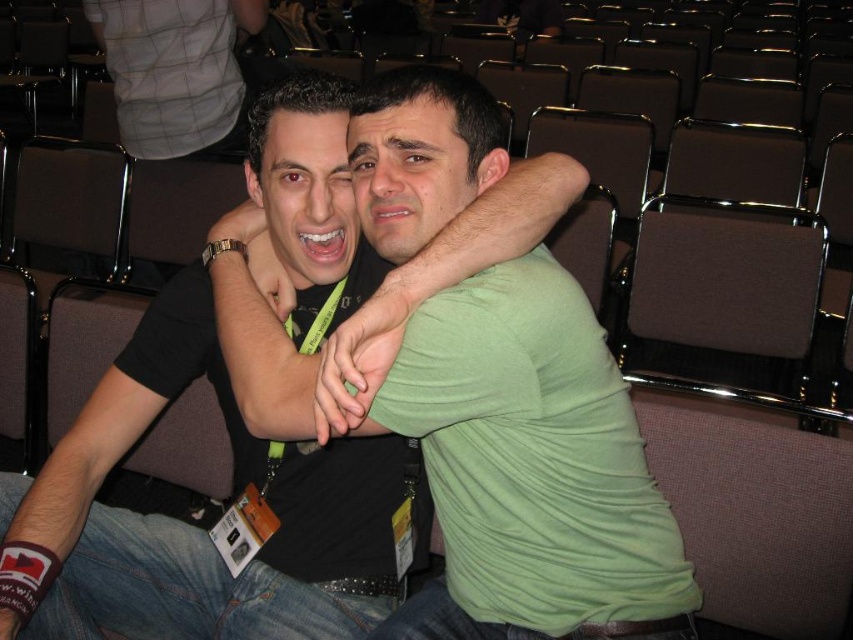
You are an event organizer checking attendee badges. You see the green matte shirt at center and the maroon fabric wristband at lower left. Which one is higher up in the image?

The green matte shirt at center is located above the maroon fabric wristband at lower left, so the green matte shirt at center is higher up in the image.

You are a photographer who needs to capture a closeup of the maroon fabric wristband at lower left and the green matte arm at center. Which object will appear larger in the photo?

The maroon fabric wristband at lower left will appear larger in the photo because it is bigger than the green matte arm at center.